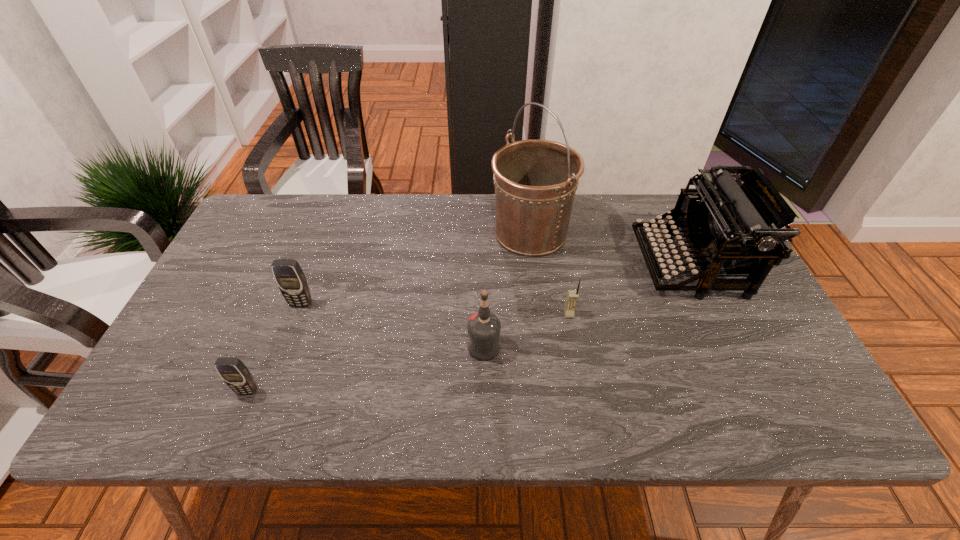
Where is `bucket`? The width and height of the screenshot is (960, 540). bucket is located at coordinates (535, 181).

You are a GUI agent. You are given a task and a screenshot of the screen. Output one action in this format:
    pyautogui.click(x=<x>, y=<y>)
    Task: Click on the fifth shortest object
    Image resolution: width=960 pixels, height=540 pixels.
    Given the screenshot: What is the action you would take?
    pyautogui.click(x=730, y=226)

Identify the location of the rightmost object. (730, 226).

This screenshot has width=960, height=540. In order to click on vodka in this screenshot , I will do `click(484, 327)`.

This screenshot has width=960, height=540. I want to click on the third tallest object, so click(x=484, y=327).

Image resolution: width=960 pixels, height=540 pixels. I want to click on the farthest cellular telephone, so click(x=290, y=278).

The image size is (960, 540). I want to click on the second farthest cellular telephone, so click(572, 297).

Identify the location of the rightmost cellular telephone. (x=572, y=297).

The image size is (960, 540). In order to click on the nearest object in this screenshot , I will do `click(235, 374)`.

I want to click on free space located on the right of the bucket, so click(680, 233).